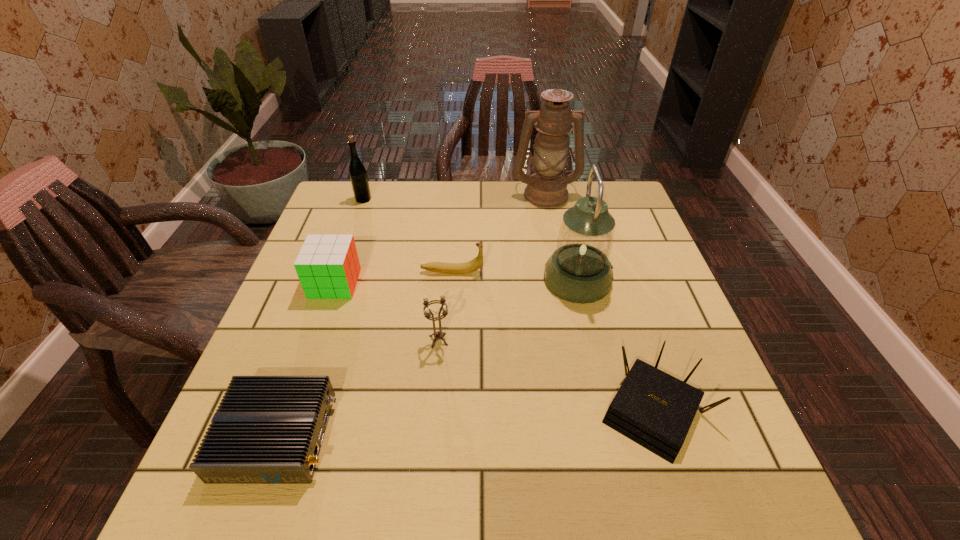
Where is `free space located 0.170m on the left of the lantern`? The height and width of the screenshot is (540, 960). free space located 0.170m on the left of the lantern is located at coordinates (477, 279).

What are the coordinates of `free space located on the front of the beer bottle` in the screenshot? It's located at (344, 256).

The width and height of the screenshot is (960, 540). In order to click on vacant space located 0.150m on the right of the candle holder in this screenshot , I will do `click(518, 340)`.

You are a GUI agent. You are given a task and a screenshot of the screen. Output one action in this format:
    pyautogui.click(x=<x>, y=<y>)
    Task: Click on the vacant area located 0.050m on the left of the cube
    The width and height of the screenshot is (960, 540).
    Given the screenshot: What is the action you would take?
    pyautogui.click(x=293, y=284)

Locate an element on the screen. vacant space located 0.200m at the stem of the banana is located at coordinates 560,272.

The image size is (960, 540). What are the coordinates of `vacant area located 0.130m on the back of the right router` in the screenshot? It's located at (626, 320).

At what (x,y) coordinates should I click in order to perform the action: click on free space located on the back panel of the left router. Please return your answer as a coordinate pair (x, y). The width and height of the screenshot is (960, 540). Looking at the image, I should click on (414, 436).

At what (x,y) coordinates should I click in order to perform the action: click on oil lamp that is at the far edge. Please return your answer as a coordinate pair (x, y). The width and height of the screenshot is (960, 540). Looking at the image, I should click on (546, 188).

Find the location of a particular element. beer bottle located at the far edge is located at coordinates (358, 175).

Locate an element on the screen. beer bottle that is at the left edge is located at coordinates (358, 175).